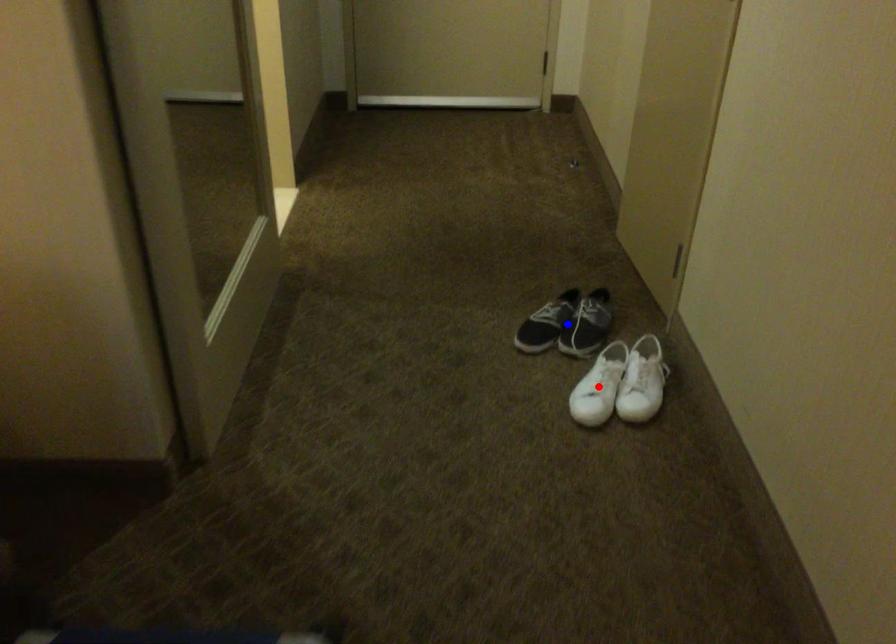
Question: In the image, two points are highlighted. Which point is nearer to the camera? Reply with the corresponding letter.

Choices:
 (A) blue point
 (B) red point

Answer: (B)